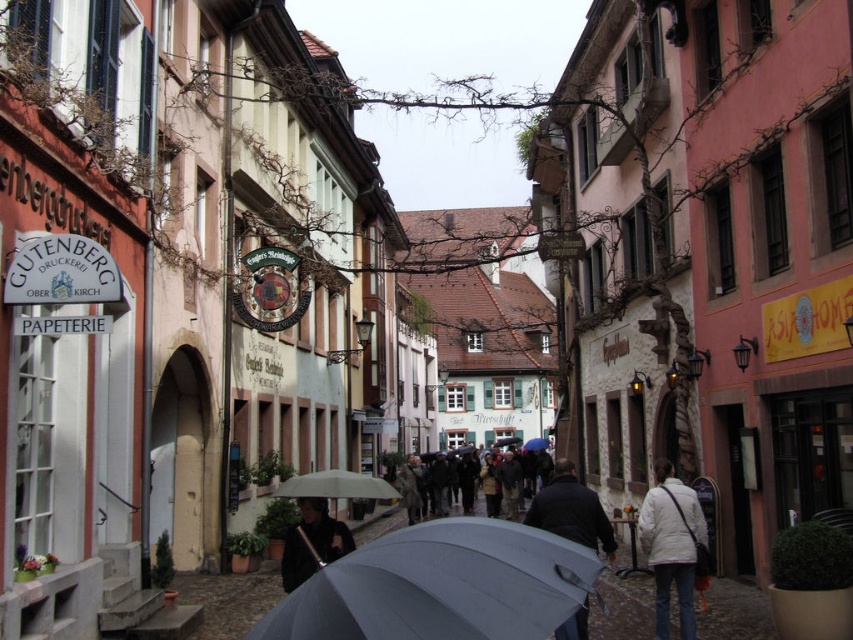
Question: Which object appears closest to the camera in this image?

Choices:
 (A) transparent fabric umbrella at center
 (B) transparent blue umbrella at center

Answer: (B)

Question: Considering the relative positions of white matte jacket at lower right and dark gray coat at center in the image provided, where is white matte jacket at lower right located with respect to dark gray coat at center?

Choices:
 (A) left
 (B) right

Answer: (B)

Question: Observing the image, what is the correct spatial positioning of matte gray umbrella at center in reference to gray matte umbrella at center?

Choices:
 (A) left
 (B) right

Answer: (B)

Question: Is matte gray umbrella at center below gray matte umbrella at center?

Choices:
 (A) no
 (B) yes

Answer: (A)

Question: Which point is closer to the camera?

Choices:
 (A) dark gray fabric umbrella at center
 (B) dark gray coat at center
 (C) black matte coat at center

Answer: (A)

Question: Which is nearer to the black matte coat at center?

Choices:
 (A) white matte jacket at lower right
 (B) dark gray fabric umbrella at center
 (C) gray matte umbrella at center
 (D) transparent blue umbrella at center

Answer: (C)